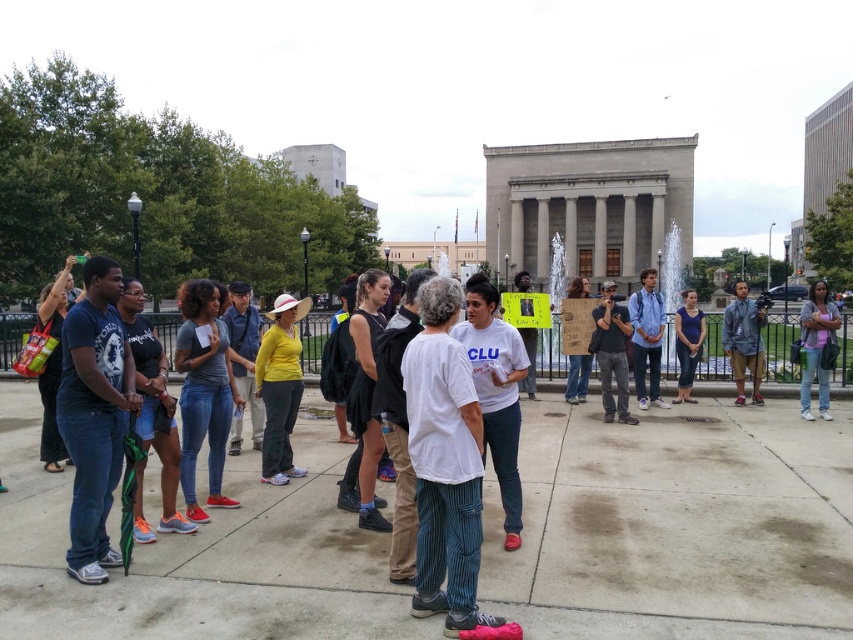
You are a photographer standing in the public square and want to take a photo of the two people wearing dark gray jeans at center and blue denim jeans at center. Which pair of jeans belongs to the taller person?

The blue denim jeans at center belong to the taller person because the dark gray jeans at center has a lesser height compared to blue denim jeans at center.